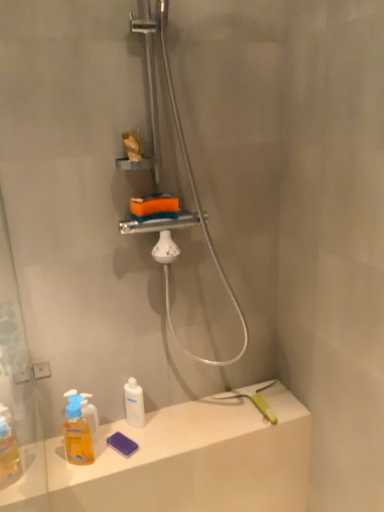
Question: Is translucent plastic mouthwash at lower left, which is the second mouthwash from right to left, oriented away from white glossy bottle at lower center, positioned as the first mouthwash in back-to-front order?

Choices:
 (A) no
 (B) yes

Answer: (A)

Question: Can you confirm if translucent plastic mouthwash at lower left, arranged as the 2th mouthwash when viewed from the back, is wider than white glossy bottle at lower center, positioned as the first mouthwash in back-to-front order?

Choices:
 (A) yes
 (B) no

Answer: (A)

Question: Considering the relative positions of translucent plastic mouthwash at lower left, which appears as the first mouthwash when viewed from the front, and white glossy bottle at lower center, which is counted as the second mouthwash, starting from the left, in the image provided, is translucent plastic mouthwash at lower left, which appears as the first mouthwash when viewed from the front, behind white glossy bottle at lower center, which is counted as the second mouthwash, starting from the left,?

Choices:
 (A) no
 (B) yes

Answer: (A)

Question: Could white glossy bottle at lower center, which is counted as the second mouthwash, starting from the left, be considered to be inside translucent plastic mouthwash at lower left, arranged as the 2th mouthwash when viewed from the back?

Choices:
 (A) yes
 (B) no

Answer: (B)

Question: Is translucent plastic mouthwash at lower left, which is the second mouthwash from right to left, taller than white glossy bottle at lower center, which is counted as the second mouthwash, starting from the left?

Choices:
 (A) no
 (B) yes

Answer: (B)

Question: From the image's perspective, is matte white counter top at lower left positioned above or below white glossy bottle at lower center, positioned as the first mouthwash in back-to-front order?

Choices:
 (A) below
 (B) above

Answer: (A)

Question: Choose the correct answer: Is matte white counter top at lower left inside white glossy bottle at lower center, positioned as the first mouthwash in back-to-front order, or outside it?

Choices:
 (A) inside
 (B) outside

Answer: (B)

Question: In terms of width, does matte white counter top at lower left look wider or thinner when compared to white glossy bottle at lower center, positioned as the first mouthwash in back-to-front order?

Choices:
 (A) wide
 (B) thin

Answer: (A)

Question: From a real-world perspective, is matte white counter top at lower left physically located above or below white glossy bottle at lower center, which is counted as the second mouthwash, starting from the left?

Choices:
 (A) below
 (B) above

Answer: (A)

Question: Is point (140, 393) closer or farther from the camera than point (110, 468)?

Choices:
 (A) farther
 (B) closer

Answer: (A)

Question: From the image's perspective, is white glossy bottle at lower center, positioned as the first mouthwash in back-to-front order, positioned above or below matte white counter top at lower left?

Choices:
 (A) above
 (B) below

Answer: (A)

Question: Choose the correct answer: Is white glossy bottle at lower center, positioned as the first mouthwash in back-to-front order, inside matte white counter top at lower left or outside it?

Choices:
 (A) outside
 (B) inside

Answer: (A)

Question: Is white glossy bottle at lower center, positioned as the first mouthwash in back-to-front order, taller or shorter than matte white counter top at lower left?

Choices:
 (A) tall
 (B) short

Answer: (A)

Question: Is translucent plastic mouthwash at lower left, positioned as the 1th mouthwash in left-to-right order, spatially inside matte white counter top at lower left, or outside of it?

Choices:
 (A) outside
 (B) inside

Answer: (A)

Question: In terms of height, does translucent plastic mouthwash at lower left, which is the second mouthwash from right to left, look taller or shorter compared to matte white counter top at lower left?

Choices:
 (A) short
 (B) tall

Answer: (B)